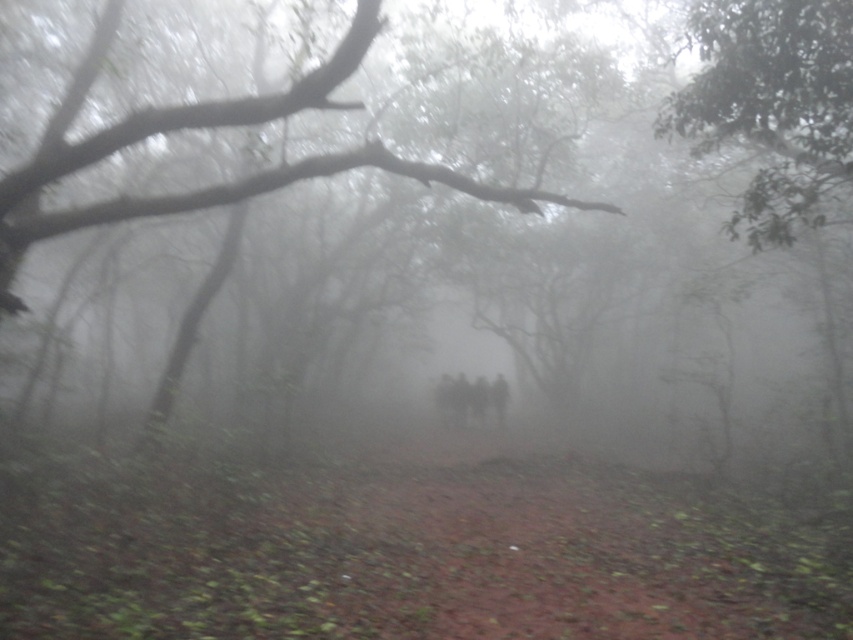
You are a hiker walking along the misty forest path and want to reach the smooth bark tree at center. Which direction should you walk to get closer to it without passing the green leafy tree at upper right?

The green leafy tree at upper right is closer to you than the smooth bark tree at center. To avoid passing the green leafy tree at upper right, you should walk towards the center of the scene where the smooth bark tree is located, moving behind the green leafy tree at upper right.

You are standing at the point with coordinates (x=407, y=554) in the misty forest. What is the terrain like at your current location?

The terrain at point (x=407, y=554) is a brown dirt path at center.